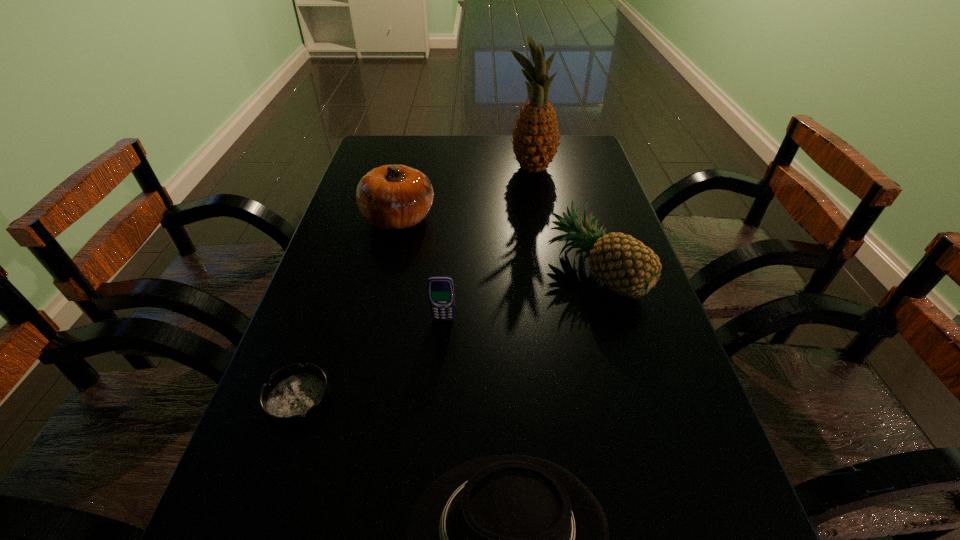
What are the coordinates of `free space located on the front-facing side of the fourth farthest object` in the screenshot? It's located at pyautogui.click(x=434, y=440).

Identify the location of vacant space located 0.080m on the back of the shortest object. The width and height of the screenshot is (960, 540). (319, 340).

Identify the location of object at the far edge. The image size is (960, 540). (535, 138).

Find the location of a particular element. pumpkin present at the left edge is located at coordinates (390, 197).

This screenshot has height=540, width=960. I want to click on ashtray that is at the left edge, so click(295, 395).

In order to click on object that is at the far right corner in this screenshot , I will do `click(535, 138)`.

Locate an element on the screen. blank space at the far edge of the desktop is located at coordinates (479, 141).

You are a GUI agent. You are given a task and a screenshot of the screen. Output one action in this format:
    pyautogui.click(x=<x>, y=<y>)
    Task: Click on the vacant space at the left edge
    
    Given the screenshot: What is the action you would take?
    pyautogui.click(x=384, y=260)

Identify the location of vacant space at the right edge of the desktop. (589, 266).

Where is `vacant space at the far left corner`? vacant space at the far left corner is located at coordinates tap(407, 153).